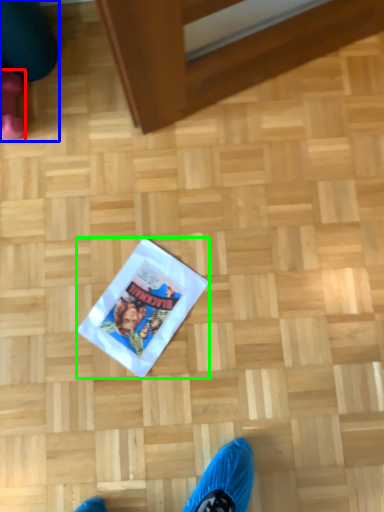
Question: Which is nearer to the footwear (highlighted by a red box)? leg (highlighted by a blue box) or flyer (highlighted by a green box).

Choices:
 (A) leg
 (B) flyer

Answer: (A)